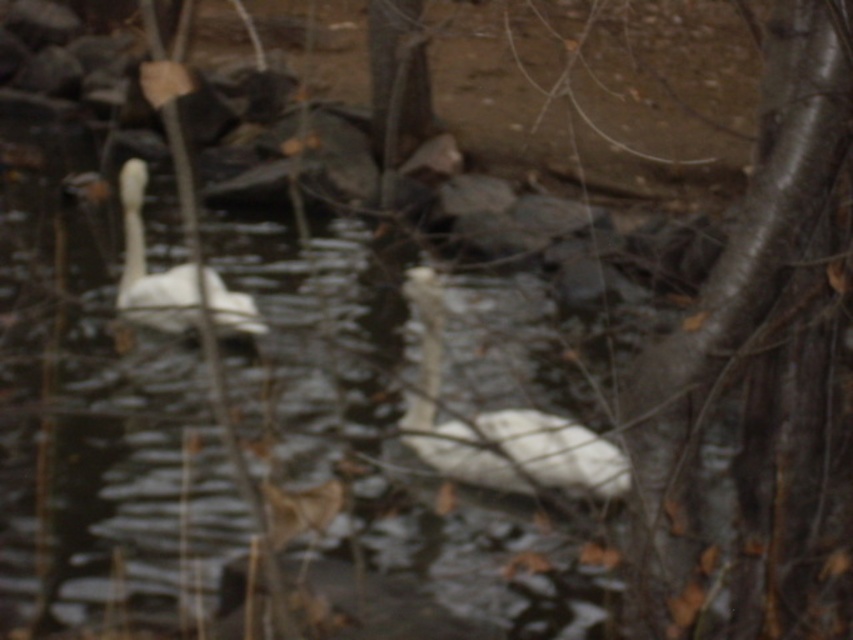
Who is taller, white matte swan at center or white matte swan at upper left?

white matte swan at upper left

You are a GUI agent. You are given a task and a screenshot of the screen. Output one action in this format:
    pyautogui.click(x=<x>, y=<y>)
    Task: Click on the white matte swan at center
    Image resolution: width=853 pixels, height=640 pixels.
    Given the screenshot: What is the action you would take?
    pyautogui.click(x=497, y=422)

Is point (585, 484) behind point (229, 317)?

No.

Identify the location of white matte swan at center. This screenshot has width=853, height=640. (497, 422).